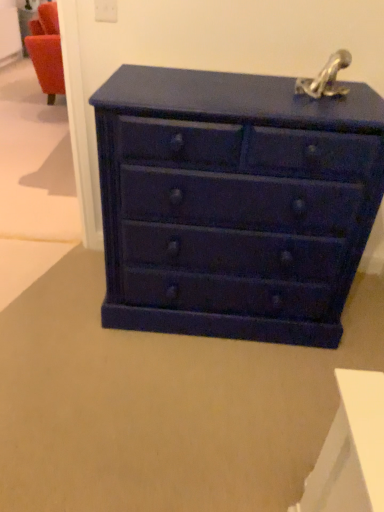
Where is `matte dark blue chest of drawers at center`? The image size is (384, 512). matte dark blue chest of drawers at center is located at coordinates (234, 203).

Describe the element at coordinates (234, 203) in the screenshot. I see `matte dark blue chest of drawers at center` at that location.

Find the location of a particular element. The image size is (384, 512). matte dark blue chest of drawers at center is located at coordinates (234, 203).